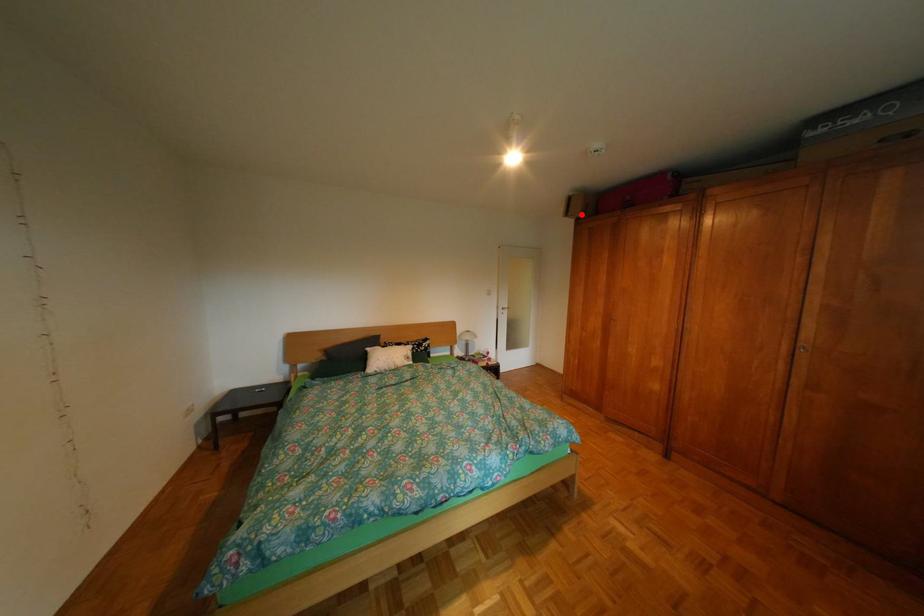
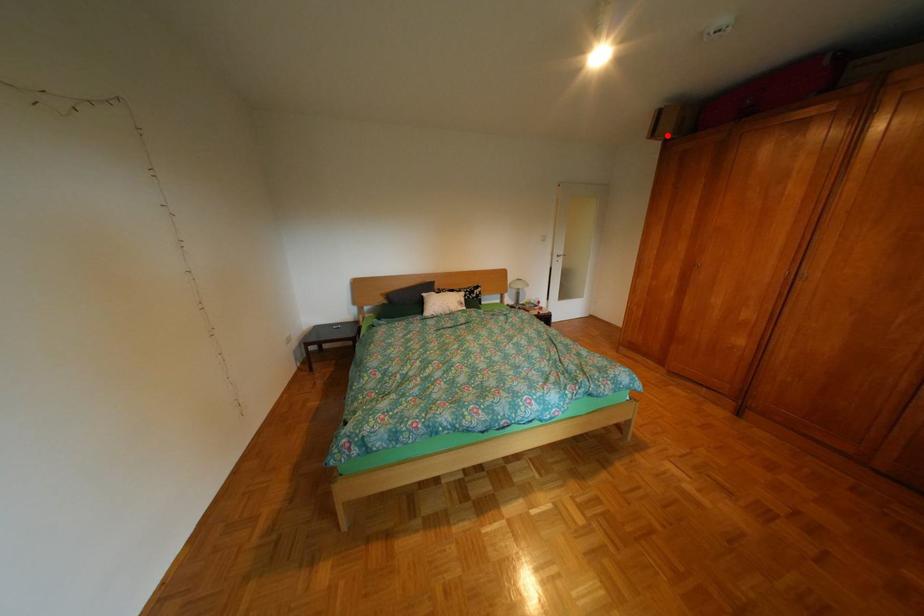
I am providing you with two images of the same scene from different viewpoints. A red point is marked on the first image and another point is marked on the second image. Does the point marked in image1 correspond to the same location as the one in image2?

Yes